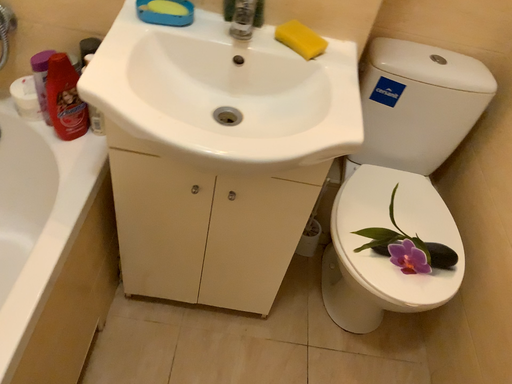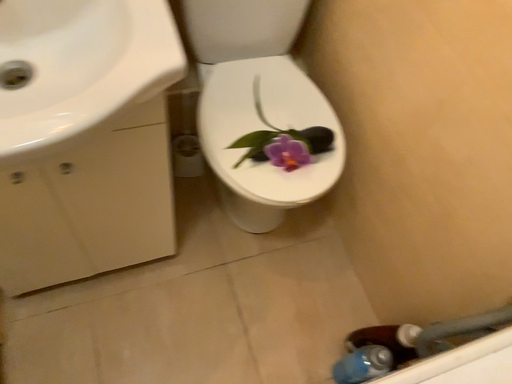
Question: Which way did the camera rotate in the video?

Choices:
 (A) rotated left
 (B) rotated right

Answer: (B)